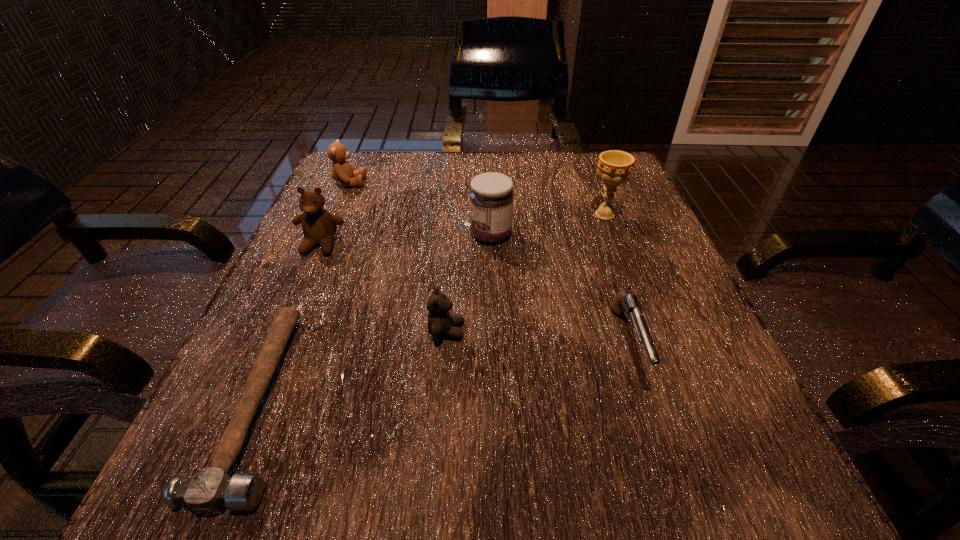
The width and height of the screenshot is (960, 540). Identify the location of blank space located on the front label of the jam. (341, 234).

The image size is (960, 540). What are the coordinates of `vacant space located 0.300m on the front label of the jam` in the screenshot? It's located at (321, 234).

Where is `vacant area situated 0.210m at the face of the tallest teddy bear`? vacant area situated 0.210m at the face of the tallest teddy bear is located at coordinates click(277, 345).

Identify the location of free space located on the front-facing side of the farthest object. The image size is (960, 540). (518, 183).

Find the location of a particular element. This screenshot has height=540, width=960. blank space located 0.090m on the face of the fourth object from left to right is located at coordinates (521, 331).

Where is `free space located aiming along the barrel of the second shortest object`? free space located aiming along the barrel of the second shortest object is located at coordinates (657, 434).

The height and width of the screenshot is (540, 960). Find the location of `vacant space situated 0.230m on the striking face of the shortest object`. vacant space situated 0.230m on the striking face of the shortest object is located at coordinates (465, 401).

Identify the location of object that is at the far edge. The image size is (960, 540). (344, 173).

Locate an element on the screen. object positioned at the near edge is located at coordinates (209, 491).

Locate an element on the screen. hammer at the left edge is located at coordinates (209, 491).